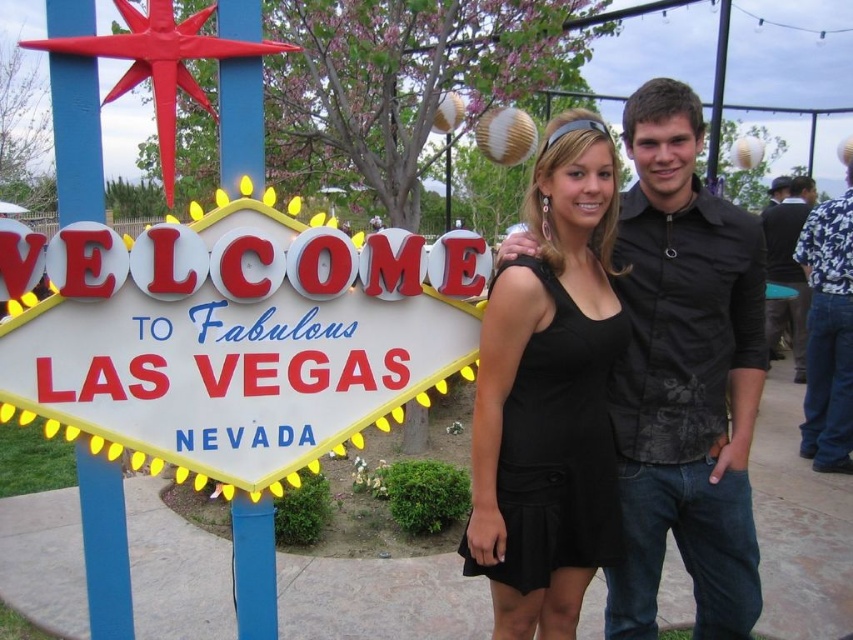
You are standing at point (567,531) and want to move to the Welcome to Fabulous Las Vegas, Nevada sign. Is the point (612,600) in front of or behind your current position?

Point (612,600) is behind point (567,531), so it is behind your current position.

You are a photographer who wants to capture a closeup of the metallic red sign at left and the black matte shirt at center. Which object is located to the left of the other?

The metallic red sign at left is positioned on the left side of black matte shirt at center, so the metallic red sign at left is to the left of the black matte shirt at center.

You are a photographer trying to position two models for a photo shoot. You have two shirts available for them to wear. The first is a black matte shirt at center, and the second is a black textured shirt at right. According to the scene, which shirt is positioned to the left of the other?

The black matte shirt at center is positioned to the left of the black textured shirt at right.